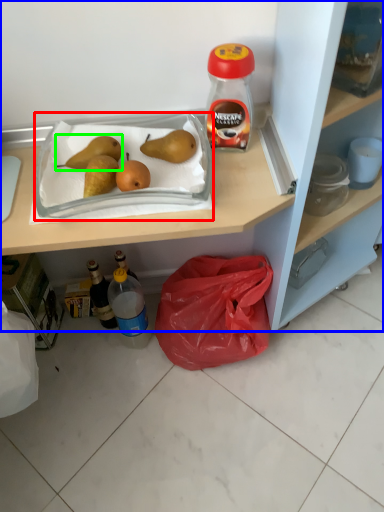
Question: Which object is the closest to the wide (highlighted by a red box)? Choose among these: cabinetry (highlighted by a blue box) or pear (highlighted by a green box).

Choices:
 (A) cabinetry
 (B) pear

Answer: (B)